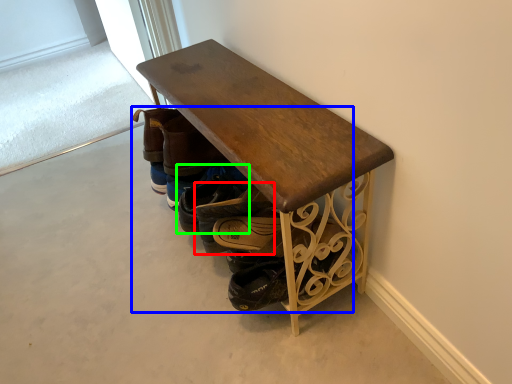
Question: Which object is the farthest from footwear (highlighted by a red box)? Choose among these: footwear (highlighted by a blue box) or footwear (highlighted by a green box).

Choices:
 (A) footwear
 (B) footwear

Answer: (A)